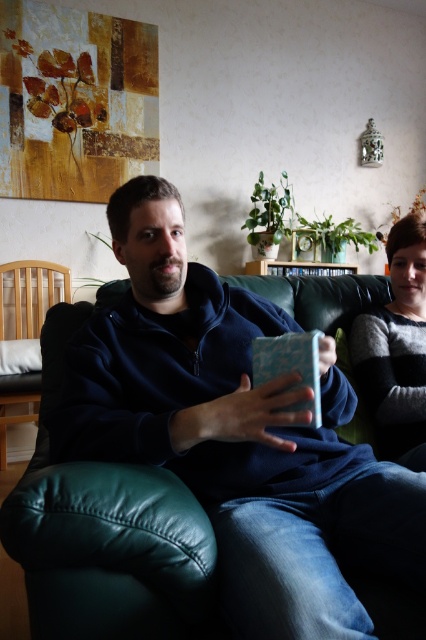
Who is more forward, (400,436) or (34,394)?

Point (400,436) is more forward.

Who is positioned more to the left, striped sweater at right or light brown wooden chair at left?

From the viewer's perspective, light brown wooden chair at left appears more on the left side.

Is point (397, 262) closer to viewer compared to point (37, 291)?

Yes, it is.

Find the location of a particular element. Image resolution: width=426 pixels, height=640 pixels. striped sweater at right is located at coordinates (397, 348).

Does point (22, 541) come farther from viewer compared to point (36, 284)?

No, it is not.

Consider the image. Can you confirm if green leather couch at center is wider than light brown wooden chair at left?

Yes.

Is point (302, 300) less distant than point (34, 416)?

Yes, it is.

The image size is (426, 640). I want to click on green leather couch at center, so click(x=106, y=531).

Who is more forward, (321, 317) or (414, 336)?

Positioned in front is point (414, 336).

Does green leather couch at center have a larger size compared to striped sweater at right?

Yes.

What do you see at coordinates (106, 531) in the screenshot? I see `green leather couch at center` at bounding box center [106, 531].

The width and height of the screenshot is (426, 640). Find the location of `green leather couch at center`. green leather couch at center is located at coordinates (106, 531).